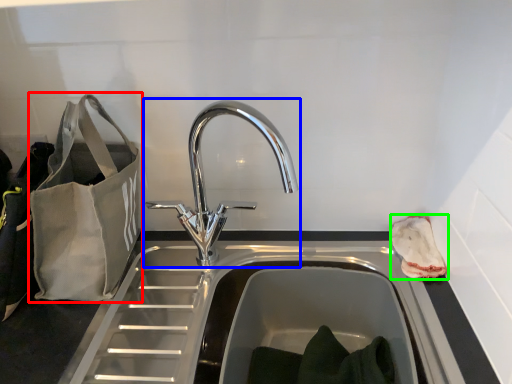
Question: Which is nearer to the bag (highlighted by a red box)? tap (highlighted by a blue box) or pouch (highlighted by a green box).

Choices:
 (A) tap
 (B) pouch

Answer: (A)